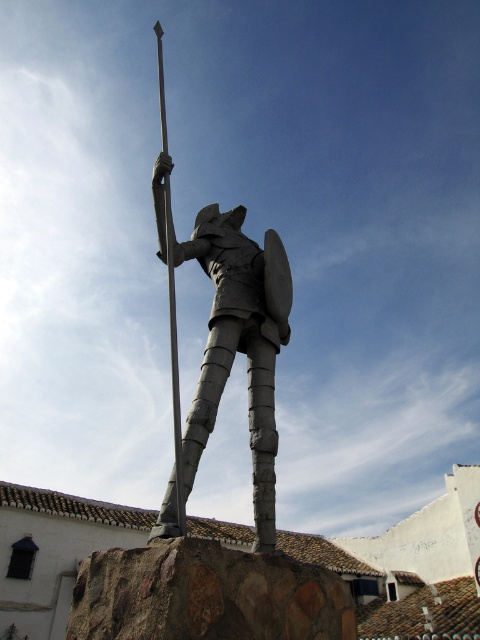
You are an architect designing a new museum exhibit and need to ensure proper spacing between the gray stone warrior at center and the polished metal pole at center. Based on their sizes, which object requires more horizontal space for display?

The polished metal pole at center requires more horizontal space because it has a greater width than the gray stone warrior at center.

You are an architect reviewing the design of a new public square. The square will feature the gray stone warrior at center and the polished metal pole at center. According to the design, which object is shorter?

The gray stone warrior at center is shorter than the polished metal pole at center.

You are an architect examining the statue from a distance. You notice two points on the statue labeled as point (215, 323) and point (168, 252). Which point is closer to your eyes?

Point (215, 323) is further to the viewer than point (168, 252), so the point closer to your eyes is point (168, 252).